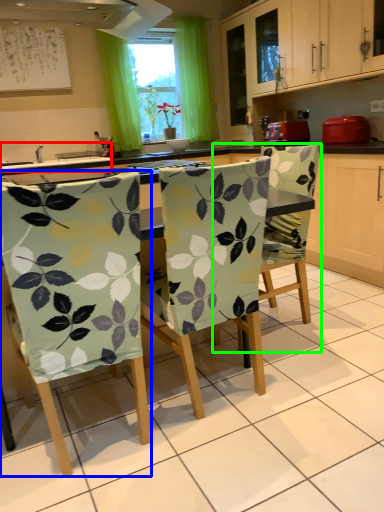
Question: Which object is positioned farthest from sink (highlighted by a red box)? Select from chair (highlighted by a blue box) and chair (highlighted by a green box).

Choices:
 (A) chair
 (B) chair

Answer: (A)